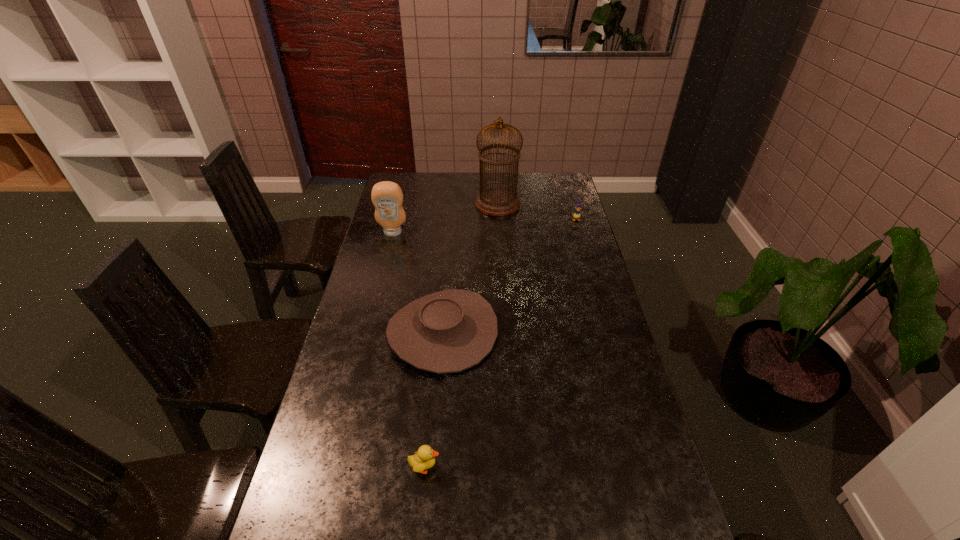
Where is `free space located on the front-facing side of the birdcage`? free space located on the front-facing side of the birdcage is located at coordinates (440, 204).

Identify the location of vacant region located on the front-facing side of the birdcage. (458, 204).

Image resolution: width=960 pixels, height=540 pixels. Identify the location of vacant region located 0.210m on the label of the fourth shortest object. (383, 271).

Where is `vacant space located 0.260m on the front of the cowboy hat`? Image resolution: width=960 pixels, height=540 pixels. vacant space located 0.260m on the front of the cowboy hat is located at coordinates (432, 464).

I want to click on vacant region located on the face of the fourth nearest object, where the monocle is placed, so click(x=587, y=258).

This screenshot has width=960, height=540. I want to click on free space located 0.190m on the front-facing side of the nearest object, so click(517, 467).

Where is `object that is at the far edge`? This screenshot has height=540, width=960. object that is at the far edge is located at coordinates (497, 201).

Where is `condiment present at the left edge`? The height and width of the screenshot is (540, 960). condiment present at the left edge is located at coordinates (387, 197).

The width and height of the screenshot is (960, 540). Identify the location of cowboy hat at the left edge. (449, 331).

Where is `object positioned at the right edge`? object positioned at the right edge is located at coordinates (576, 215).